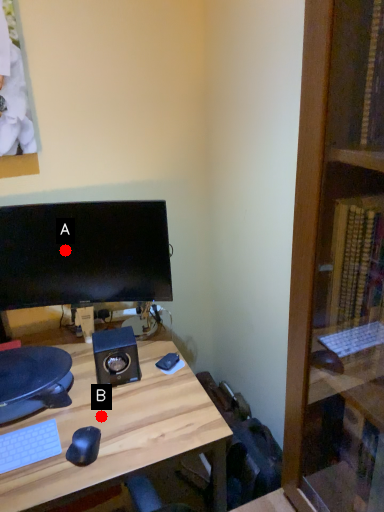
Question: Two points are circled on the image, labeled by A and B beside each circle. Which point is closer to the camera taking this photo?

Choices:
 (A) A is closer
 (B) B is closer

Answer: (B)